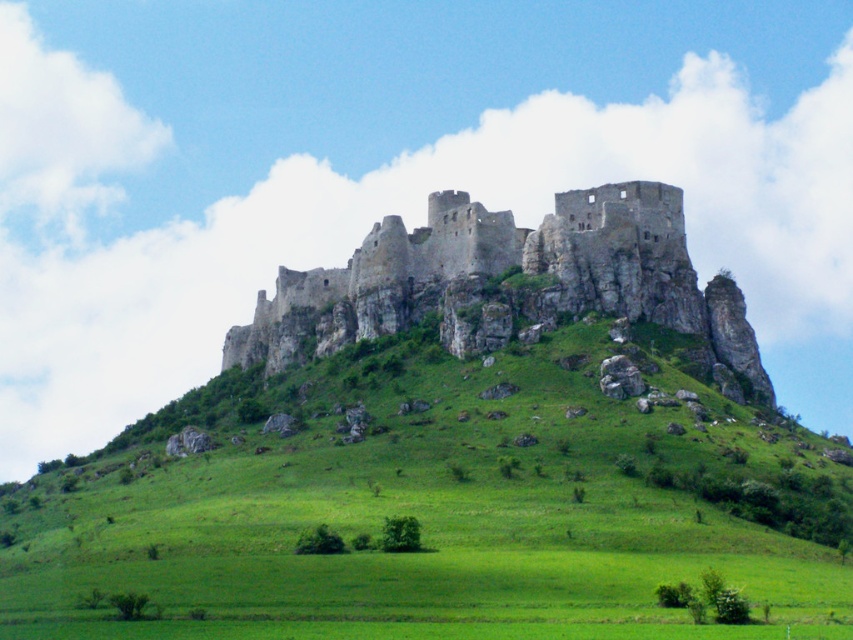
Question: Is green grassy hill at center thinner than rustic stone castle at center?

Choices:
 (A) no
 (B) yes

Answer: (A)

Question: Which object is closer to the camera taking this photo?

Choices:
 (A) rustic stone castle at center
 (B) green grassy hill at center

Answer: (B)

Question: Which point is closer to the camera?

Choices:
 (A) (206, 515)
 (B) (398, 317)

Answer: (A)

Question: Is green grassy hill at center further to the viewer compared to rustic stone castle at center?

Choices:
 (A) no
 (B) yes

Answer: (A)

Question: Is green grassy hill at center to the left of rustic stone castle at center from the viewer's perspective?

Choices:
 (A) yes
 (B) no

Answer: (A)